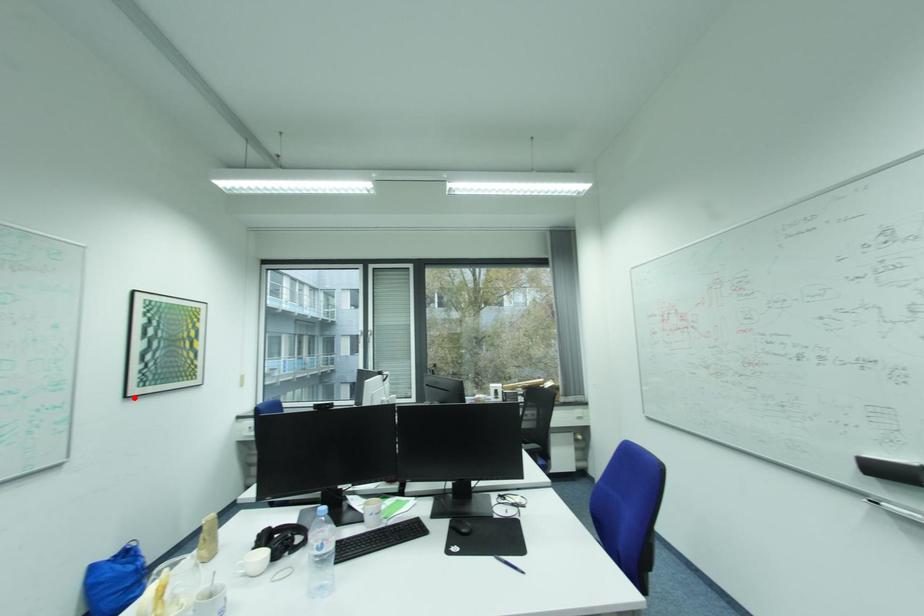
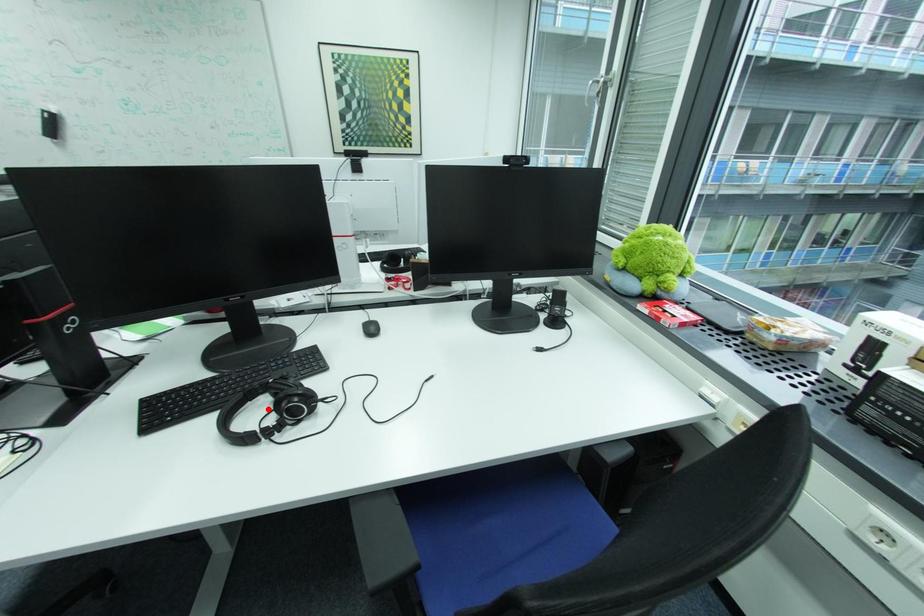
I am providing you with two images of the same scene from different viewpoints. A red point is marked on the first image and another point is marked on the second image. Is the marked point in image1 the same physical position as the marked point in image2?

No